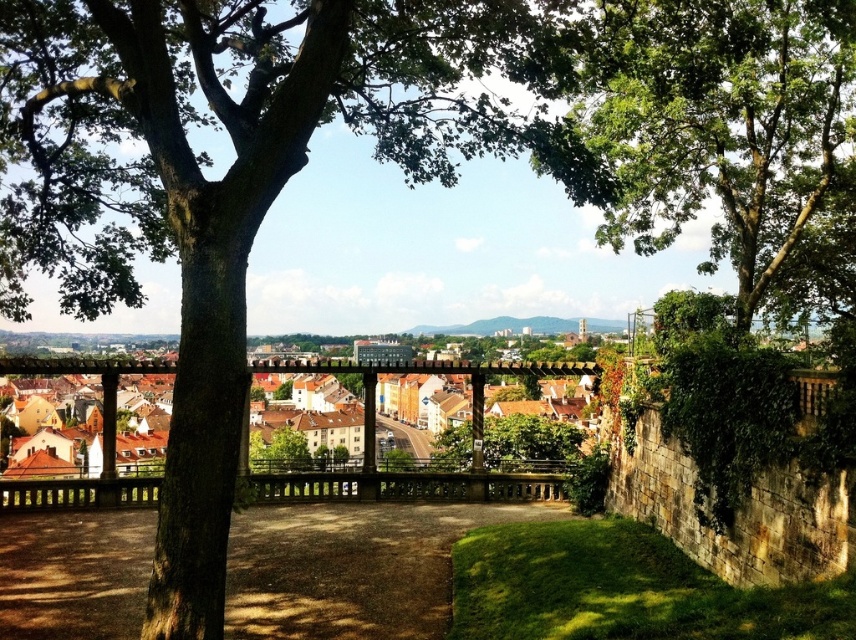
You are standing at the vantage point overlooking the town and want to take a photo. There are two points marked in the scene, point 1 at coordinates point (480,52) and point 2 at coordinates point (711,305). Which point is closer to your current position?

Point (480,52) is further to the camera than point (711,305), so the point closer to your current position is point (711,305).

You are a bird looking to perch on the highest branch possible. Which tree would you choose between the green leafy tree at upper center and the green leafy tree at center?

The green leafy tree at upper center might be wider than the green leafy tree at center, but the question is about height. Since the tree at upper center is positioned higher in the frame, it might be taller, allowing the bird to perch higher.

You are standing at the top of the stone wall and looking down at the two green leafy trees. Which tree is closer to you, the green leafy tree at upper center or the green leafy tree at center?

The green leafy tree at upper center is closer to you because it is in front of the green leafy tree at center.